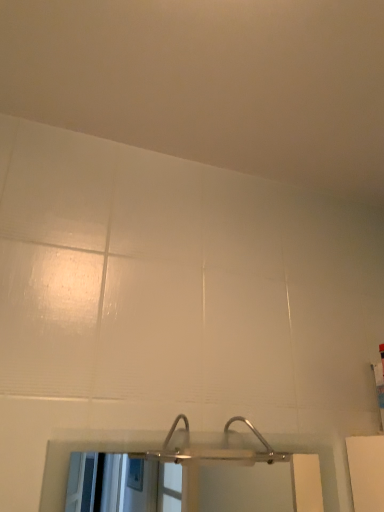
Locate an element on the screen. This screenshot has height=512, width=384. clear plastic shower at center is located at coordinates (217, 446).

This screenshot has width=384, height=512. What do you see at coordinates (217, 446) in the screenshot? I see `clear plastic shower at center` at bounding box center [217, 446].

Identify the location of clear plastic shower at center. This screenshot has height=512, width=384. (217, 446).